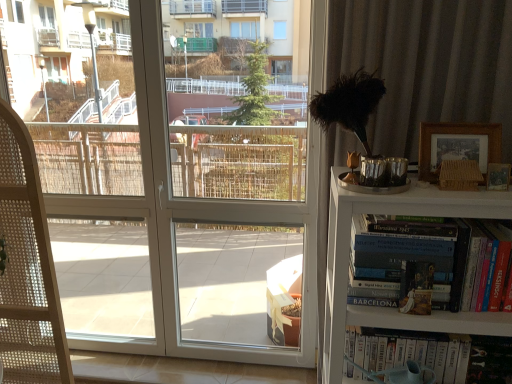
Question: From the image's perspective, is hardcover book at right, arranged as the first book when viewed from the top, on woven wood folding chair at left?

Choices:
 (A) yes
 (B) no

Answer: (A)

Question: Considering the relative sizes of hardcover book at right, marked as the 2th book in a bottom-to-top arrangement, and woven wood folding chair at left in the image provided, is hardcover book at right, marked as the 2th book in a bottom-to-top arrangement, thinner than woven wood folding chair at left?

Choices:
 (A) yes
 (B) no

Answer: (A)

Question: Considering the relative positions of hardcover book at right, arranged as the first book when viewed from the top, and woven wood folding chair at left in the image provided, is hardcover book at right, arranged as the first book when viewed from the top, to the left of woven wood folding chair at left from the viewer's perspective?

Choices:
 (A) yes
 (B) no

Answer: (B)

Question: From the image's perspective, is hardcover book at right, marked as the 2th book in a bottom-to-top arrangement, located beneath woven wood folding chair at left?

Choices:
 (A) no
 (B) yes

Answer: (A)

Question: From a real-world perspective, is hardcover book at right, marked as the 2th book in a bottom-to-top arrangement, physically above woven wood folding chair at left?

Choices:
 (A) no
 (B) yes

Answer: (B)

Question: From the image's perspective, is wooden picture frame at upper right, arranged as the first picture frame when ordered from the bottom, located above or below hardcover book at right?

Choices:
 (A) above
 (B) below

Answer: (A)

Question: Is point (492, 173) closer or farther from the camera than point (489, 240)?

Choices:
 (A) closer
 (B) farther

Answer: (B)

Question: Is wooden picture frame at upper right, arranged as the first picture frame when ordered from the bottom, taller or shorter than hardcover book at right?

Choices:
 (A) tall
 (B) short

Answer: (B)

Question: From a real-world perspective, is wooden picture frame at upper right, which appears as the second picture frame when viewed from the top, physically located above or below hardcover book at right?

Choices:
 (A) below
 (B) above

Answer: (B)

Question: Relative to hardcover book at right, is woven wood folding chair at left in front or behind?

Choices:
 (A) front
 (B) behind

Answer: (B)

Question: Considering the positions of point (50, 347) and point (498, 294), is point (50, 347) closer or farther from the camera than point (498, 294)?

Choices:
 (A) closer
 (B) farther

Answer: (B)

Question: Looking at the image, does woven wood folding chair at left seem bigger or smaller compared to hardcover book at right?

Choices:
 (A) big
 (B) small

Answer: (A)

Question: Is woven wood folding chair at left spatially inside hardcover book at right, or outside of it?

Choices:
 (A) inside
 (B) outside

Answer: (B)

Question: In the image, is white glossy screen door at center on the left side or the right side of woven wood folding chair at left?

Choices:
 (A) right
 (B) left

Answer: (A)

Question: From a real-world perspective, relative to woven wood folding chair at left, is white glossy screen door at center vertically above or below?

Choices:
 (A) below
 (B) above

Answer: (B)